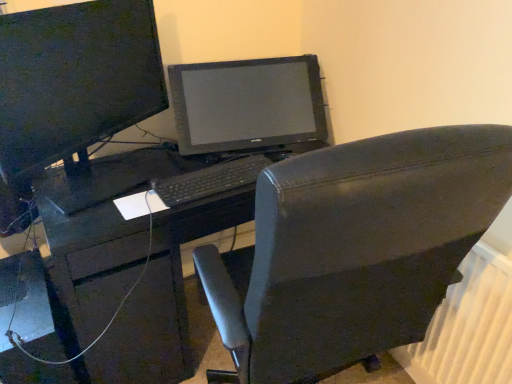
Identify the location of black plastic keyboard at center. The width and height of the screenshot is (512, 384). (209, 180).

Describe the element at coordinates (71, 89) in the screenshot. I see `matte black monitor at upper left` at that location.

I want to click on black plastic keyboard at center, so click(x=209, y=180).

Where is `radiator below the matte black desk at center (from a real-world perspective)`? radiator below the matte black desk at center (from a real-world perspective) is located at coordinates (468, 327).

From a real-world perspective, is matte black desk at center physically located above or below white plastic radiator at lower right?

Clearly, from a real-world perspective, matte black desk at center is above white plastic radiator at lower right.

Which object is closer to the camera taking this photo, matte black desk at center or white plastic radiator at lower right?

white plastic radiator at lower right is in front.

Is matte black desk at center not close to white plastic radiator at lower right?

matte black desk at center is actually quite close to white plastic radiator at lower right.

Can you confirm if white plastic radiator at lower right is wider than black plastic keyboard at center?

No.

From a real-world perspective, who is located higher, white plastic radiator at lower right or black plastic keyboard at center?

In real-world perspective, black plastic keyboard at center is above.

Could you tell me if white plastic radiator at lower right is facing black plastic keyboard at center?

No, white plastic radiator at lower right is not oriented towards black plastic keyboard at center.

Does white plastic radiator at lower right contain black plastic keyboard at center?

No, black plastic keyboard at center is not inside white plastic radiator at lower right.

Is white plastic radiator at lower right at the right side of matte black desk at center?

Yes.

Would you say white plastic radiator at lower right is inside or outside matte black desk at center?

white plastic radiator at lower right is located beyond the bounds of matte black desk at center.

Can you confirm if white plastic radiator at lower right is taller than matte black desk at center?

Incorrect, the height of white plastic radiator at lower right is not larger of that of matte black desk at center.

From a real-world perspective, is white plastic radiator at lower right under matte black desk at center?

Indeed, from a real-world perspective, white plastic radiator at lower right is positioned beneath matte black desk at center.

Which is correct: matte black desk at center is inside matte black monitor at upper left, or outside of it?

The correct answer is: outside.

From the image's perspective, which is above, matte black desk at center or matte black monitor at upper left?

From the image's view, matte black monitor at upper left is above.

Which of these two, matte black desk at center or matte black monitor at upper left, stands shorter?

matte black monitor at upper left.

Who is more distant, black plastic keyboard at center or matte black desk at center?

black plastic keyboard at center is behind.

Is black plastic keyboard at center spatially inside matte black desk at center, or outside of it?

black plastic keyboard at center is located beyond the bounds of matte black desk at center.

Is black plastic keyboard at center looking in the opposite direction of matte black desk at center?

No, black plastic keyboard at center is not facing away from matte black desk at center.

Is point (190, 182) more distant than point (156, 317)?

No, it is not.

Is black leather chair at center inside or outside of matte black desk at center?

black leather chair at center is not enclosed by matte black desk at center.

From the image's perspective, which one is positioned higher, black leather chair at center or matte black desk at center?

matte black desk at center appears higher in the image.

Considering the sizes of objects black leather chair at center and matte black desk at center in the image provided, who is wider, black leather chair at center or matte black desk at center?

With larger width is black leather chair at center.

Is matte black monitor at upper left not close to black plastic keyboard at center?

Actually, matte black monitor at upper left and black plastic keyboard at center are a little close together.

Is point (1, 178) positioned before point (253, 171)?

Yes, point (1, 178) is closer to viewer.

Is matte black monitor at upper left to the left or to the right of black plastic keyboard at center in the image?

In the image, matte black monitor at upper left appears on the left side of black plastic keyboard at center.

Does matte black monitor at upper left turn towards black plastic keyboard at center?

Yes, matte black monitor at upper left is aimed at black plastic keyboard at center.

Where is `radiator to the right of matte black desk at center`? The height and width of the screenshot is (384, 512). radiator to the right of matte black desk at center is located at coordinates (468, 327).

Find the location of a particular element. This screenshot has width=512, height=384. radiator located in front of the black plastic keyboard at center is located at coordinates (468, 327).

Which object lies nearer to the anchor point black leather chair at center, matte black monitor at upper left or white plastic radiator at lower right?

white plastic radiator at lower right is closer to black leather chair at center.

From the image, which object appears to be farther from matte black desk at center, matte black monitor at upper left or black leather chair at center?

black leather chair at center lies further to matte black desk at center than the other object.

When comparing their distances from black plastic keyboard at center, does matte black monitor at upper left or white plastic radiator at lower right seem further?

Among the two, white plastic radiator at lower right is located further to black plastic keyboard at center.

Estimate the real-world distances between objects in this image. Which object is closer to white plastic radiator at lower right, black plastic keyboard at center or matte black desk at center?

The object closer to white plastic radiator at lower right is black plastic keyboard at center.

From the image, which object appears to be farther from matte black monitor at upper left, matte black desk at center or black plastic keyboard at center?

black plastic keyboard at center.

Estimate the real-world distances between objects in this image. Which object is closer to black leather chair at center, white plastic radiator at lower right or matte black monitor at upper left?

white plastic radiator at lower right is positioned closer to the anchor black leather chair at center.

Which object lies further to the anchor point black plastic keyboard at center, black leather chair at center or matte black desk at center?

black leather chair at center.

Based on their spatial positions, is black plastic keyboard at center or white plastic radiator at lower right closer to matte black monitor at upper left?

The object closer to matte black monitor at upper left is black plastic keyboard at center.

In order to click on chair located between matte black monitor at upper left and white plastic radiator at lower right in the left-right direction in this screenshot , I will do 355,249.

I want to click on desk located between black leather chair at center and black plastic keyboard at center in the depth direction, so click(x=164, y=298).

Locate an element on the screen. The width and height of the screenshot is (512, 384). desk between matte black monitor at upper left and white plastic radiator at lower right is located at coordinates (164, 298).

The height and width of the screenshot is (384, 512). Find the location of `chair between black plastic keyboard at center and white plastic radiator at lower right in the horizontal direction`. chair between black plastic keyboard at center and white plastic radiator at lower right in the horizontal direction is located at coordinates (355, 249).